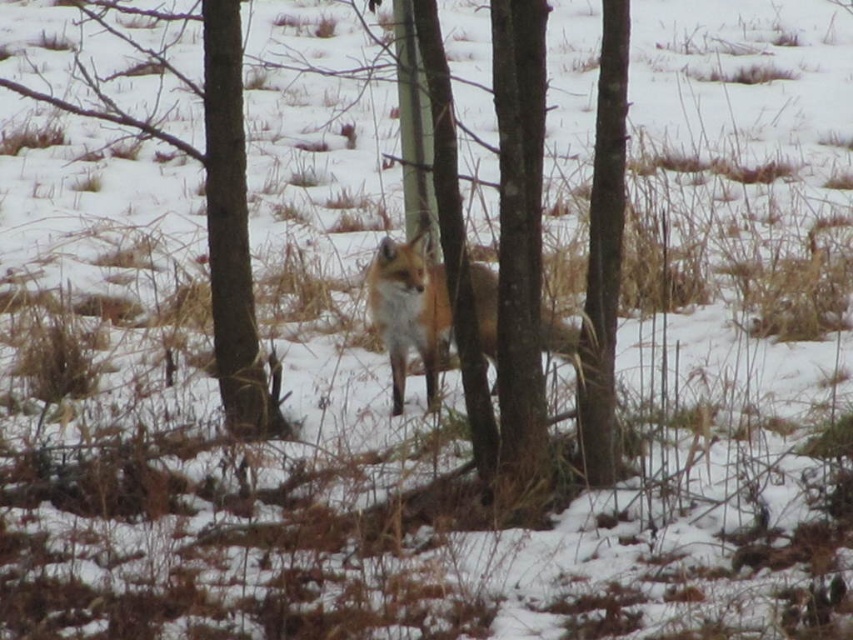
Question: Is smooth bark tree at center positioned in front of smooth bark tree at right?

Choices:
 (A) no
 (B) yes

Answer: (B)

Question: Which object is the closest to the smooth bark tree at right?

Choices:
 (A) brown bark tree at center
 (B) fluffy reddish-brown fox at center

Answer: (B)

Question: Is smooth bark tree at right to the right of fluffy reddish-brown fox at center from the viewer's perspective?

Choices:
 (A) yes
 (B) no

Answer: (A)

Question: Which object is closer to the camera taking this photo?

Choices:
 (A) smooth bark tree at right
 (B) brown bark tree at center
 (C) smooth bark tree at center

Answer: (C)

Question: Which object is closer to the camera taking this photo?

Choices:
 (A) smooth bark tree at center
 (B) smooth bark tree at right
 (C) fluffy reddish-brown fox at center

Answer: (A)

Question: Is brown bark tree at center below fluffy reddish-brown fox at center?

Choices:
 (A) yes
 (B) no

Answer: (B)